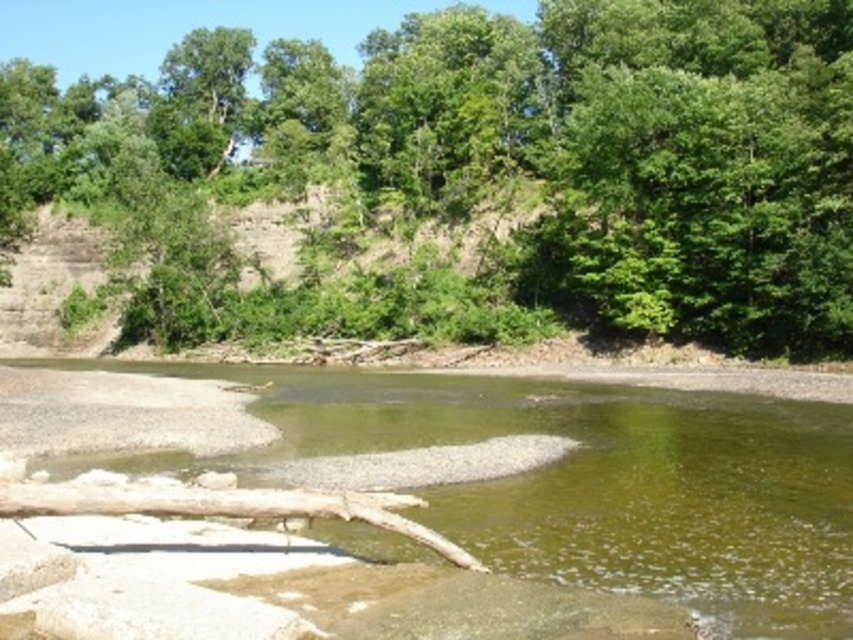
Looking at this image, can you confirm if green leafy tree at center is positioned to the left of green sedimentary rock at center?

Yes, green leafy tree at center is to the left of green sedimentary rock at center.

Which is in front, point (548, 156) or point (436, 497)?

Positioned in front is point (436, 497).

What are the coordinates of `green leafy tree at center` in the screenshot? It's located at (479, 173).

Who is higher up, green leafy tree at center or brown wood log at lower center?

green leafy tree at center is above.

Does green leafy tree at center appear over brown wood log at lower center?

Yes.

This screenshot has width=853, height=640. I want to click on green leafy tree at center, so click(479, 173).

Can you confirm if green sedimentary rock at center is shorter than brown wood log at lower center?

Correct, green sedimentary rock at center is not as tall as brown wood log at lower center.

Can you confirm if green sedimentary rock at center is thinner than brown wood log at lower center?

No, green sedimentary rock at center is not thinner than brown wood log at lower center.

I want to click on green sedimentary rock at center, so click(589, 481).

The height and width of the screenshot is (640, 853). Identify the location of green sedimentary rock at center. (589, 481).